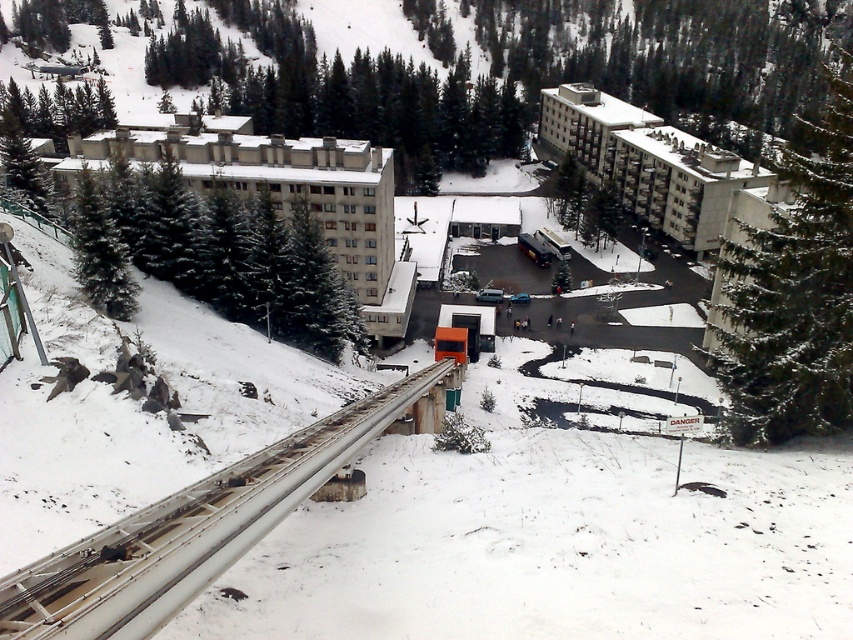
You are standing at the base of the mountain and want to reach the point marked at coordinate point (242, 548). Given that your maximum comfortable walking distance on snow is 25 feet, can you safely reach the point without assistance?

The point marked at coordinate point (242, 548) is 30.94 feet away from you, which exceeds your maximum comfortable walking distance of 25 feet on snow. Therefore, you cannot safely reach the point without assistance.

Looking at this image, you are standing at the point marked by the coordinates point (190,531), which is the white metallic train track at lower left. You want to walk towards the nearest building in the scene. Which direction should you walk to reach it?

The nearest building is located in the middle ground, so you should walk towards the middle ground from the white metallic train track at lower left to reach it.